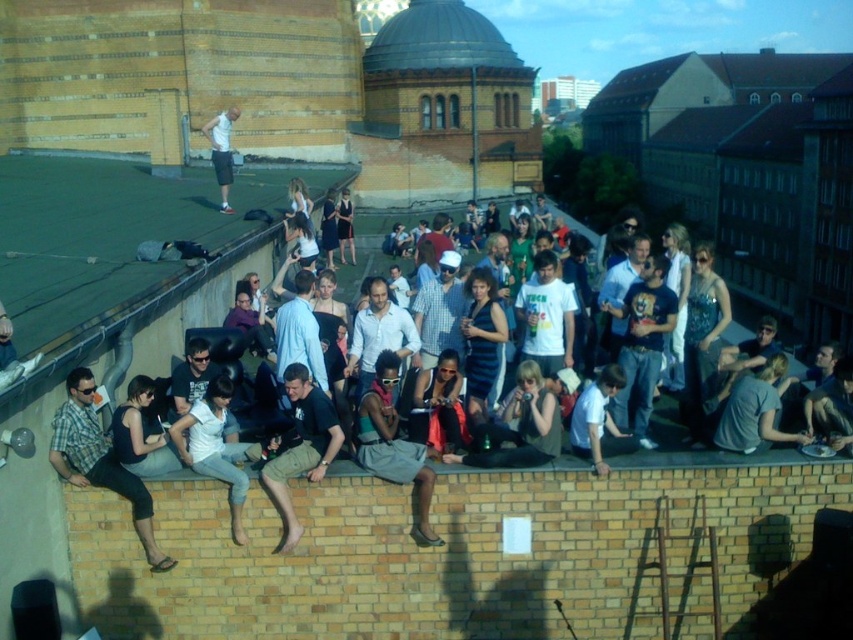
Is black cotton shirt at center above black fabric dress at lower left?

Actually, black cotton shirt at center is below black fabric dress at lower left.

Is black cotton shirt at center positioned at the back of black fabric dress at lower left?

Yes, black cotton shirt at center is further from the viewer.

Which is in front, point (297, 417) or point (115, 410)?

Point (115, 410)

At what (x,y) coordinates should I click in order to perform the action: click on black cotton shirt at center. Please return your answer as a coordinate pair (x, y). Looking at the image, I should click on (300, 448).

Does point (93, 429) come closer to viewer compared to point (222, 410)?

Yes, point (93, 429) is closer to viewer.

Can you confirm if matte black shirt at lower left is wider than white cotton shirt at center?

Yes.

Where is `matte black shirt at lower left`? matte black shirt at lower left is located at coordinates (99, 460).

Is black fabric dress at lower left to the left of white cotton shirt at upper center from the viewer's perspective?

No, black fabric dress at lower left is not to the left of white cotton shirt at upper center.

Between point (144, 426) and point (233, 118), which one is positioned behind?

Point (233, 118)

Identify the location of black fabric dress at lower left. (141, 433).